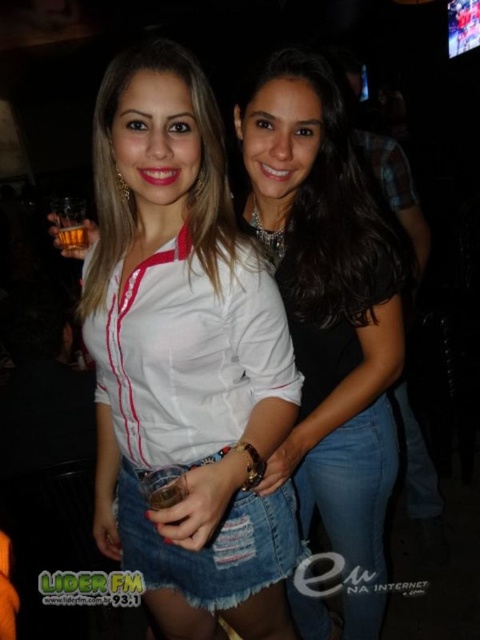
Question: Is white matte shirt at center smaller than translucent amber glass at center?

Choices:
 (A) no
 (B) yes

Answer: (A)

Question: Which object is farther from the camera taking this photo?

Choices:
 (A) denim jeans at center
 (B) translucent amber glass at center

Answer: (B)

Question: Which point is farther to the camera?

Choices:
 (A) translucent amber glass at center
 (B) denim jeans at center

Answer: (A)

Question: Which object is positioned farthest from the denim jeans at center?

Choices:
 (A) translucent amber glass at center
 (B) white matte shirt at center

Answer: (A)

Question: Is white matte shirt at center above translucent amber glass at center?

Choices:
 (A) yes
 (B) no

Answer: (B)

Question: Can you confirm if denim jeans at center is wider than translucent amber glass at center?

Choices:
 (A) yes
 (B) no

Answer: (A)